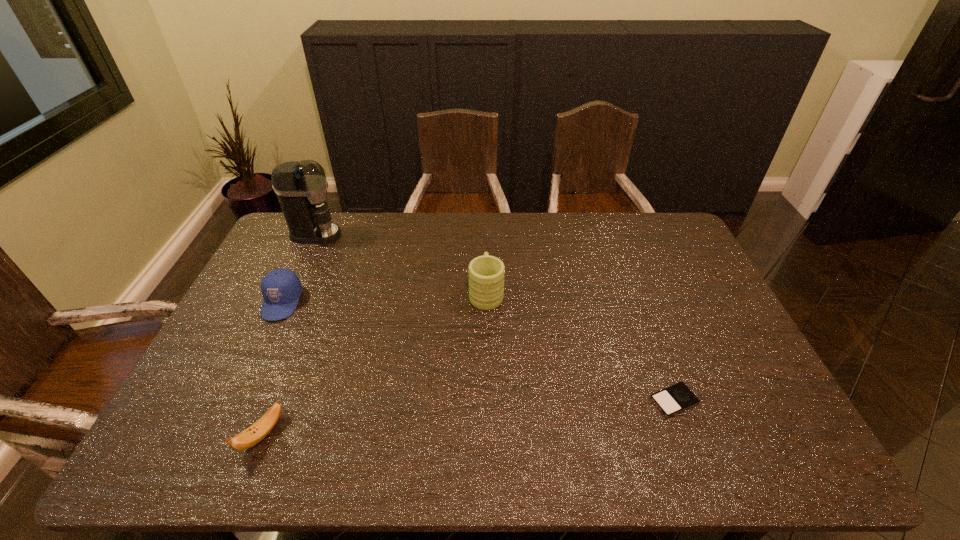
Where is `vacant region located 0.230m on the side of the mug with the handle`? The image size is (960, 540). vacant region located 0.230m on the side of the mug with the handle is located at coordinates (485, 235).

This screenshot has height=540, width=960. I want to click on free region located 0.070m on the side of the mug with the handle, so click(486, 262).

The height and width of the screenshot is (540, 960). I want to click on blank area located 0.270m on the front-facing side of the cap, so (235, 403).

Where is `free location located on the right of the fourth tallest object`? The width and height of the screenshot is (960, 540). free location located on the right of the fourth tallest object is located at coordinates (418, 434).

Where is `vacant space located 0.170m on the left of the iPod`? The image size is (960, 540). vacant space located 0.170m on the left of the iPod is located at coordinates (583, 401).

Locate an element on the screen. This screenshot has width=960, height=540. object situated at the far edge is located at coordinates (301, 187).

The width and height of the screenshot is (960, 540). In order to click on object located at the near edge in this screenshot , I will do `click(253, 435)`.

Where is `coffee maker at the left edge`? The image size is (960, 540). coffee maker at the left edge is located at coordinates (301, 187).

This screenshot has height=540, width=960. What are the coordinates of `cap present at the left edge` in the screenshot? It's located at (281, 288).

Locate an element on the screen. This screenshot has height=540, width=960. object present at the far left corner is located at coordinates (301, 187).